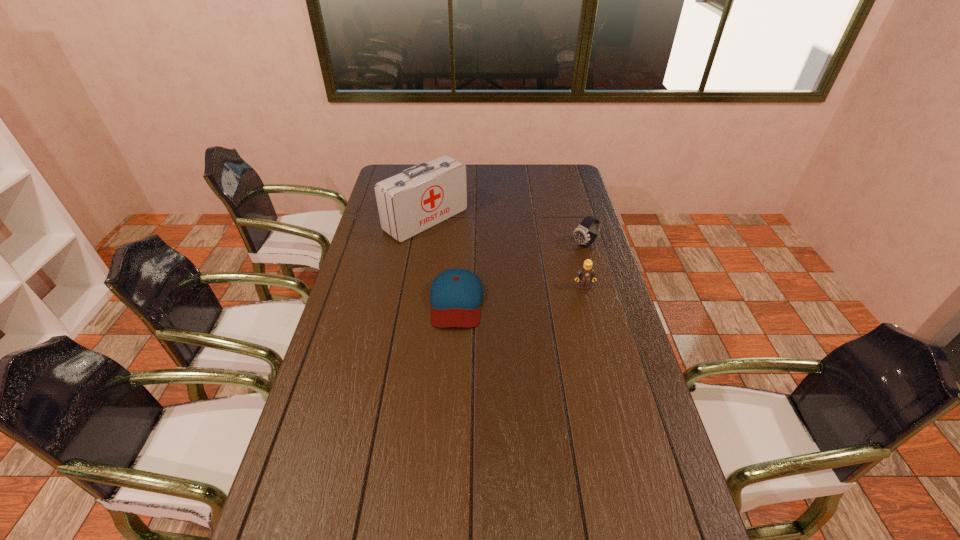
In order to click on free space between the first-aid kit and the Lego in this screenshot , I will do `click(505, 253)`.

Identify the location of free area in between the first-aid kit and the watch. (505, 232).

Find the location of a particular element. This screenshot has height=540, width=960. empty space that is in between the watch and the tallest object is located at coordinates (505, 232).

Locate an element on the screen. Image resolution: width=960 pixels, height=540 pixels. empty location between the shortest object and the watch is located at coordinates pos(520,273).

The image size is (960, 540). In order to click on vacant area between the Lego and the baseball cap in this screenshot , I will do `click(520, 294)`.

You are a GUI agent. You are given a task and a screenshot of the screen. Output one action in this format:
    pyautogui.click(x=<x>, y=<y>)
    Task: Click on the free space between the shortest object and the tallest object
    Image resolution: width=960 pixels, height=540 pixels.
    Given the screenshot: What is the action you would take?
    pyautogui.click(x=442, y=260)

Locate an element on the screen. The width and height of the screenshot is (960, 540). the closest object to the shortest object is located at coordinates (420, 197).

Identify which object is located as the nearest to the shortest object. Please provide its 2D coordinates. Your answer should be formatted as a tuple, i.e. [(x, y)], where the tuple contains the x and y coordinates of a point satisfying the conditions above.

[(420, 197)]

I want to click on free region that satisfies the following two spatial constraints: 1. on the front side of the first-aid kit; 2. on the right side of the watch, so click(x=422, y=245).